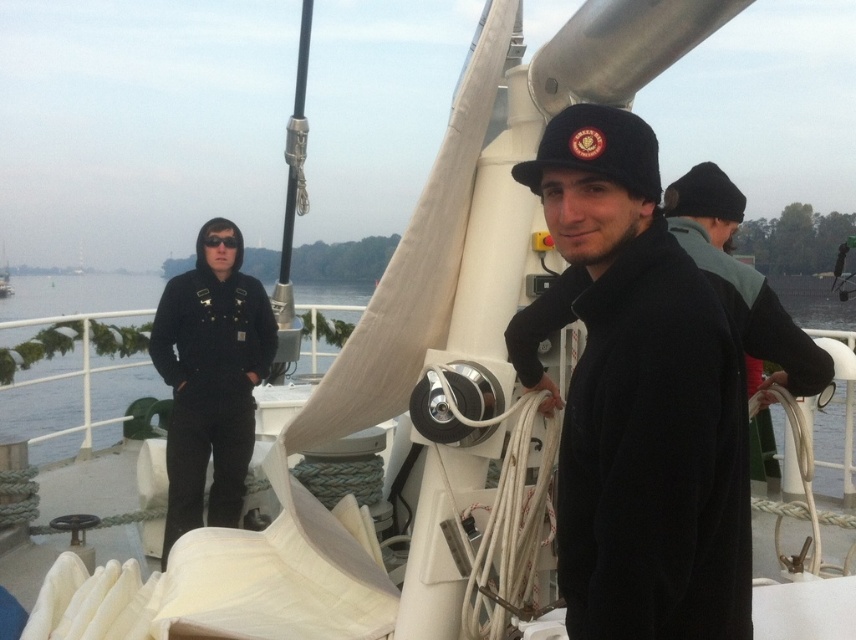
Is black fleece jacket at left shorter than blue water at center?

Incorrect, black fleece jacket at left's height does not fall short of blue water at center's.

Does black fleece jacket at left have a lesser width compared to blue water at center?

Yes.

What do you see at coordinates (210, 378) in the screenshot? I see `black fleece jacket at left` at bounding box center [210, 378].

Locate an element on the screen. black fleece jacket at left is located at coordinates (210, 378).

Is point (697, 465) more distant than point (174, 342)?

That is False.

Who is higher up, black fleece jacket at center or black fleece jacket at left?

Positioned higher is black fleece jacket at center.

The width and height of the screenshot is (856, 640). What do you see at coordinates (646, 449) in the screenshot? I see `black fleece jacket at center` at bounding box center [646, 449].

Where is `black fleece jacket at center`? black fleece jacket at center is located at coordinates (646, 449).

Between black fleece jacket at center and blue water at center, which one is positioned lower?

black fleece jacket at center

Which is behind, point (593, 612) or point (25, 280)?

Point (25, 280)

This screenshot has width=856, height=640. What do you see at coordinates (646, 449) in the screenshot? I see `black fleece jacket at center` at bounding box center [646, 449].

Where is `black fleece jacket at center`? black fleece jacket at center is located at coordinates [x=646, y=449].